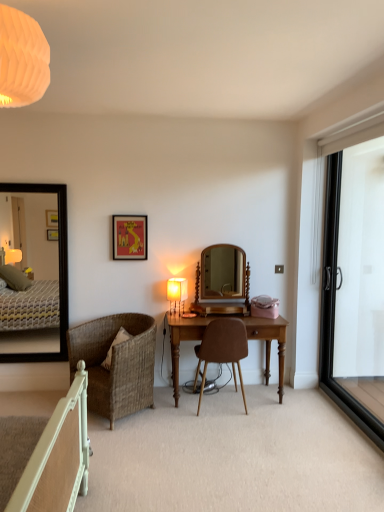
Question: Is black glass screen door at right shorter than wooden desk at center?

Choices:
 (A) yes
 (B) no

Answer: (B)

Question: Can you confirm if black glass screen door at right is bigger than wooden desk at center?

Choices:
 (A) no
 (B) yes

Answer: (A)

Question: Is black glass screen door at right to the right of wooden desk at center from the viewer's perspective?

Choices:
 (A) no
 (B) yes

Answer: (B)

Question: From the image's perspective, would you say black glass screen door at right is shown under wooden desk at center?

Choices:
 (A) no
 (B) yes

Answer: (A)

Question: Is black glass screen door at right facing away from wooden desk at center?

Choices:
 (A) no
 (B) yes

Answer: (A)

Question: Considering the relative sizes of black glass screen door at right and wooden desk at center in the image provided, is black glass screen door at right taller than wooden desk at center?

Choices:
 (A) no
 (B) yes

Answer: (B)

Question: Considering the relative sizes of matte white power outlet at center-right and brown leather chair at center, marked as the first chair in a right-to-left arrangement, in the image provided, is matte white power outlet at center-right shorter than brown leather chair at center, marked as the first chair in a right-to-left arrangement,?

Choices:
 (A) no
 (B) yes

Answer: (B)

Question: Can you confirm if matte white power outlet at center-right is taller than brown leather chair at center, marked as the first chair in a right-to-left arrangement?

Choices:
 (A) no
 (B) yes

Answer: (A)

Question: Is matte white power outlet at center-right at the right side of brown leather chair at center, which appears as the second chair when viewed from the left?

Choices:
 (A) no
 (B) yes

Answer: (B)

Question: Is matte white power outlet at center-right completely or partially outside of brown leather chair at center, marked as the first chair in a right-to-left arrangement?

Choices:
 (A) yes
 (B) no

Answer: (A)

Question: From a real-world perspective, is matte white power outlet at center-right located higher than brown leather chair at center, marked as the first chair in a right-to-left arrangement?

Choices:
 (A) yes
 (B) no

Answer: (A)

Question: Can you see matte white power outlet at center-right touching brown leather chair at center, which appears as the second chair when viewed from the left?

Choices:
 (A) no
 (B) yes

Answer: (A)

Question: Does wooden mirror at center, which appears as the 2th mirror when viewed from the left, have a greater width compared to wooden desk at center?

Choices:
 (A) yes
 (B) no

Answer: (B)